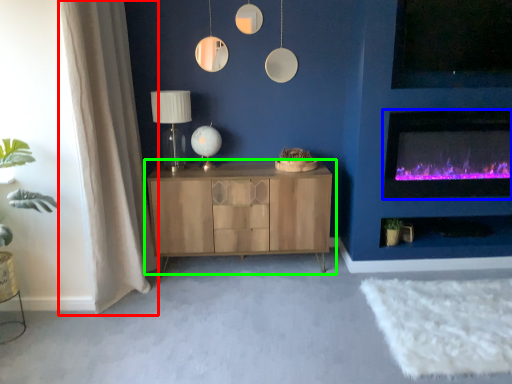
Question: Considering the real-world distances, which object is farthest from curtain (highlighted by a red box)? wood burning stove (highlighted by a blue box) or cabinetry (highlighted by a green box)?

Choices:
 (A) wood burning stove
 (B) cabinetry

Answer: (A)